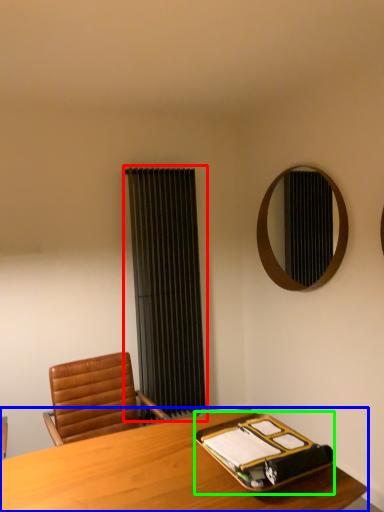
Question: Based on their relative distances, which object is nearer to curtain (highlighted by a red box)? Choose from desk (highlighted by a blue box) and binder (highlighted by a green box).

Choices:
 (A) desk
 (B) binder

Answer: (A)